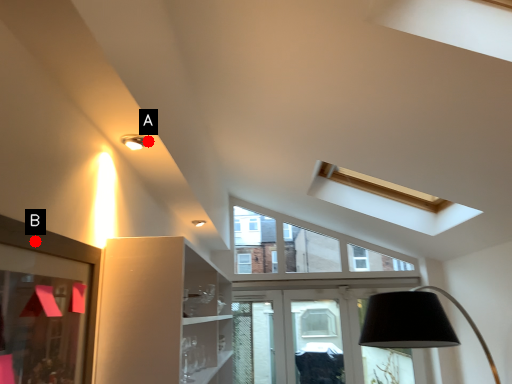
Question: Two points are circled on the image, labeled by A and B beside each circle. Which point is closer to the camera?

Choices:
 (A) A is closer
 (B) B is closer

Answer: (B)